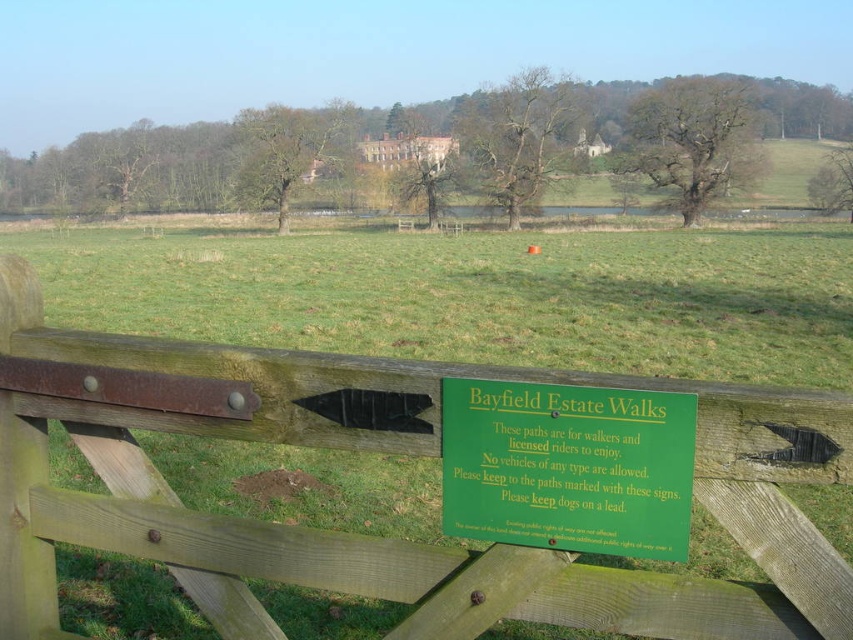
Does green wooden fence at center lie in front of green plastic sign at center?

Yes, it is.

Between green wooden fence at center and green plastic sign at center, which one has less height?

green plastic sign at center is shorter.

This screenshot has width=853, height=640. Identify the location of green wooden fence at center. (387, 452).